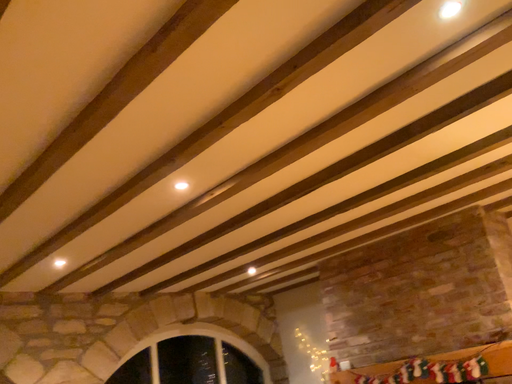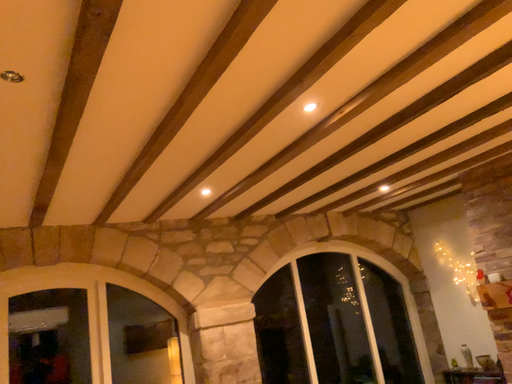
Question: Which way did the camera rotate in the video?

Choices:
 (A) rotated left
 (B) rotated right

Answer: (A)